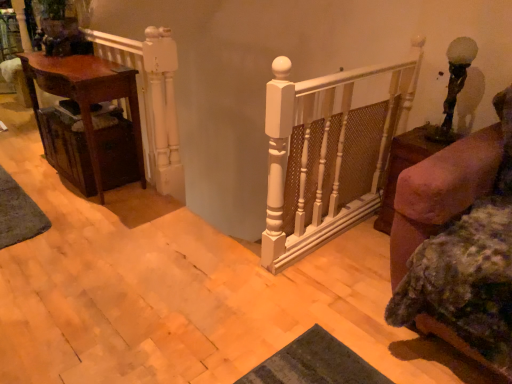
What do you see at coordinates (152, 100) in the screenshot?
I see `white painted wood railing at upper left` at bounding box center [152, 100].

What is the approximate height of woven brown drawer at left?

The height of woven brown drawer at left is 15.86 inches.

What do you see at coordinates (85, 97) in the screenshot? I see `matte brown table at left` at bounding box center [85, 97].

What is the approximate height of green textured mat at lower left?

green textured mat at lower left is 4.73 centimeters tall.

Where is `white painted wood railing at upper left`? white painted wood railing at upper left is located at coordinates click(152, 100).

Is point (173, 125) in front of point (83, 114)?

No.

Between white painted wood railing at upper left and matte brown table at left, which one appears on the right side from the viewer's perspective?

Positioned to the right is white painted wood railing at upper left.

Is white painted wood railing at upper left turned away from matte brown table at left?

Yes, white painted wood railing at upper left is facing away from matte brown table at left.

Is white painted wood railing at upper left smaller than matte brown table at left?

Correct, white painted wood railing at upper left occupies less space than matte brown table at left.

Is white painted wood railing at upper left facing away from woven brown drawer at left?

Correct, white painted wood railing at upper left is looking away from woven brown drawer at left.

Can you confirm if white painted wood railing at upper left is positioned to the left of woven brown drawer at left?

Incorrect, white painted wood railing at upper left is not on the left side of woven brown drawer at left.

Is woven brown drawer at left a part of white painted wood railing at upper left?

No, woven brown drawer at left is not inside white painted wood railing at upper left.

Is white painted wood railing at upper left positioned in front of woven brown drawer at left?

Yes, it is in front of woven brown drawer at left.

Is matte brown table at left aimed at woven brown drawer at left?

Yes, matte brown table at left is facing woven brown drawer at left.

Which of these two, matte brown table at left or woven brown drawer at left, is wider?

woven brown drawer at left.

Between point (141, 142) and point (95, 192), which one is positioned in front?

The point (95, 192) is closer to the camera.

Can we say matte brown table at left lies outside woven brown drawer at left?

No, matte brown table at left is inside woven brown drawer at left's boundary.

In terms of height, does brown wooden side table at right look taller or shorter compared to woven brown drawer at left?

Clearly, brown wooden side table at right is taller compared to woven brown drawer at left.

Looking at this image, considering the sizes of objects brown wooden side table at right and woven brown drawer at left in the image provided, who is smaller, brown wooden side table at right or woven brown drawer at left?

Smaller between the two is woven brown drawer at left.

Does point (488, 193) lie behind point (50, 139)?

That is False.

Between point (115, 65) and point (14, 235), which one is positioned in front?

The point (14, 235) is closer.

In the scene shown: From their relative heights in the image, would you say matte brown table at left is taller or shorter than green textured mat at lower left?

Considering their sizes, matte brown table at left has more height than green textured mat at lower left.

Can you confirm if matte brown table at left is thinner than green textured mat at lower left?

No, matte brown table at left is not thinner than green textured mat at lower left.

Is matte brown table at left beside green textured mat at lower left?

No, matte brown table at left is not touching green textured mat at lower left.

Is brown wooden side table at right smaller than green textured mat at lower left?

No, brown wooden side table at right is not smaller than green textured mat at lower left.

Looking at this image, from a real-world perspective, between brown wooden side table at right and green textured mat at lower left, who is vertically lower?

green textured mat at lower left.

Is green textured mat at lower left at the back of brown wooden side table at right?

That's not correct — brown wooden side table at right is not looking away from green textured mat at lower left.

Is green textured mat at lower left a part of brown wooden side table at right?

That's incorrect, green textured mat at lower left is not inside brown wooden side table at right.

Can you confirm if woven brown drawer at left is thinner than matte brown table at left?

No, woven brown drawer at left is not thinner than matte brown table at left.

Based on their positions, is woven brown drawer at left located to the left or right of matte brown table at left?

woven brown drawer at left is positioned on matte brown table at left's right side.

What's the angular difference between woven brown drawer at left and matte brown table at left's facing directions?

The angle between the facing direction of woven brown drawer at left and the facing direction of matte brown table at left is 2.15 degrees.

Considering the sizes of woven brown drawer at left and matte brown table at left in the image, is woven brown drawer at left taller or shorter than matte brown table at left?

Clearly, woven brown drawer at left is shorter compared to matte brown table at left.

What are the coordinates of `table located underneath the white painted wood railing at upper left (from a real-world perspective)` in the screenshot? It's located at (85, 97).

Where is `rail that appears in front of the woven brown drawer at left`? The height and width of the screenshot is (384, 512). rail that appears in front of the woven brown drawer at left is located at coordinates (152, 100).

Estimate the real-world distances between objects in this image. Which object is further from green textured mat at lower left, white painted wood railing at upper left or brown wooden side table at right?

Based on the image, brown wooden side table at right appears to be further to green textured mat at lower left.

Looking at the image, which one is located closer to matte brown table at left, brown wooden side table at right or green textured mat at lower left?

green textured mat at lower left is positioned closer to the anchor matte brown table at left.

Estimate the real-world distances between objects in this image. Which object is closer to woven brown drawer at left, green textured mat at lower left or matte brown table at left?

matte brown table at left lies closer to woven brown drawer at left than the other object.

Looking at this image, when comparing their distances from matte brown table at left, does woven brown drawer at left or brown wooden side table at right seem further?

brown wooden side table at right is further to matte brown table at left.

Considering their positions, is brown wooden side table at right positioned closer to woven brown drawer at left than matte brown table at left?

matte brown table at left lies closer to woven brown drawer at left than the other object.

Estimate the real-world distances between objects in this image. Which object is closer to matte brown table at left, woven brown drawer at left or white painted wood railing at upper left?

woven brown drawer at left is closer to matte brown table at left.

Looking at this image, from the image, which object appears to be farther from brown wooden side table at right, white painted wood railing at upper left or green textured mat at lower left?

green textured mat at lower left is positioned further to the anchor brown wooden side table at right.

Considering their positions, is matte brown table at left positioned further to green textured mat at lower left than white painted wood railing at upper left?

white painted wood railing at upper left is further to green textured mat at lower left.

Locate an element on the screen. This screenshot has height=384, width=512. table between white painted wood railing at upper left and woven brown drawer at left in the up-down direction is located at coordinates (85, 97).

You are a GUI agent. You are given a task and a screenshot of the screen. Output one action in this format:
    pyautogui.click(x=<x>, y=<y>)
    Task: Click on the drawer that lies between white painted wood railing at upper left and green textured mat at lower left from top to bottom
    Image resolution: width=512 pixels, height=384 pixels.
    Given the screenshot: What is the action you would take?
    pyautogui.click(x=68, y=149)

The width and height of the screenshot is (512, 384). What are the coordinates of `rail between woven brown drawer at left and brown wooden side table at right from left to right` in the screenshot? It's located at (152, 100).

Where is `table between green textured mat at lower left and brown wooden side table at right in the horizontal direction`? Image resolution: width=512 pixels, height=384 pixels. table between green textured mat at lower left and brown wooden side table at right in the horizontal direction is located at coordinates (85, 97).